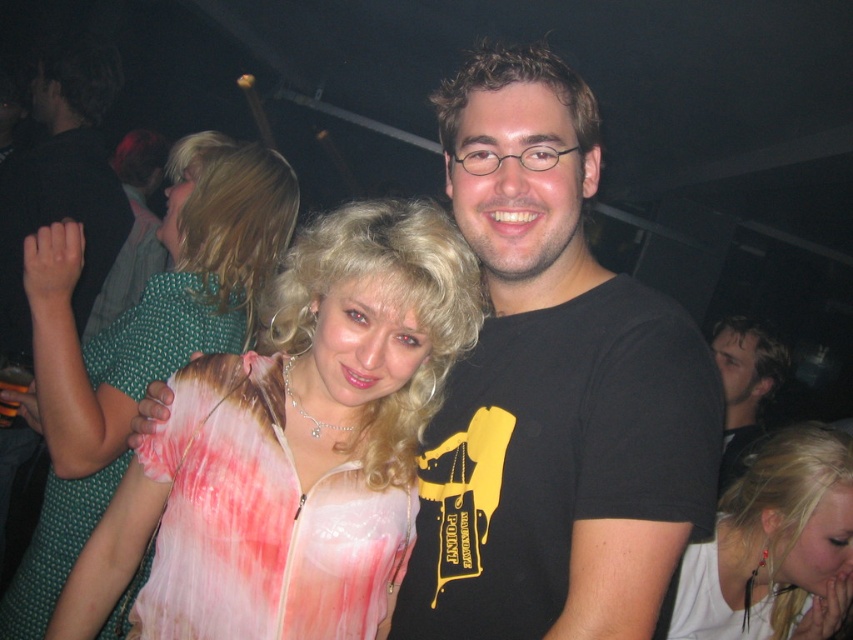
You are at a party and want to find the translucent pink fabric dress at center. According to the scene description, where exactly is it positioned?

The translucent pink fabric dress at center is located at point (260, 522).

You are a photographer at the party and need to position a spotlight exactly at the center of the white textured dress at center. What coordinates should you aim for?

The coordinates to aim the spotlight at are 0.697 on the x axis and 0.346 on the y axis.